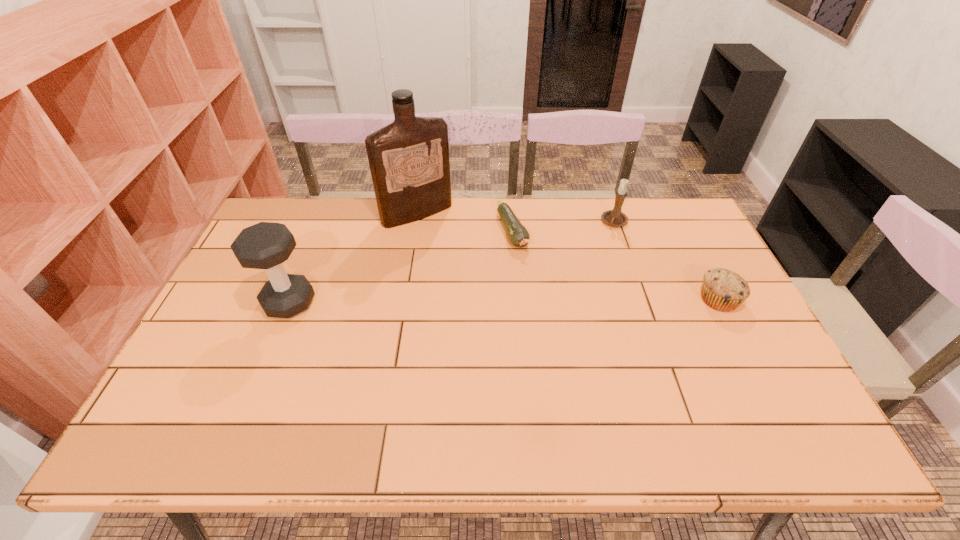
Locate an element on the screen. dumbbell is located at coordinates (266, 245).

Find the location of a particular element. Image resolution: width=960 pixels, height=540 pixels. the second tallest object is located at coordinates (266, 245).

Where is `the fourth tallest object`? The width and height of the screenshot is (960, 540). the fourth tallest object is located at coordinates (723, 290).

Where is `the rightmost object`? the rightmost object is located at coordinates (723, 290).

Find the location of a particular element. The height and width of the screenshot is (540, 960). liquor is located at coordinates (409, 162).

The image size is (960, 540). Identify the location of the tallest object. (409, 162).

What are the coordinates of `the third object from right to left` in the screenshot? It's located at (518, 235).

Where is `zucchini`? The height and width of the screenshot is (540, 960). zucchini is located at coordinates (518, 235).

Locate an element on the screen. The image size is (960, 540). the third tallest object is located at coordinates pyautogui.click(x=615, y=218).

Identify the location of candle holder. The image size is (960, 540). (615, 218).